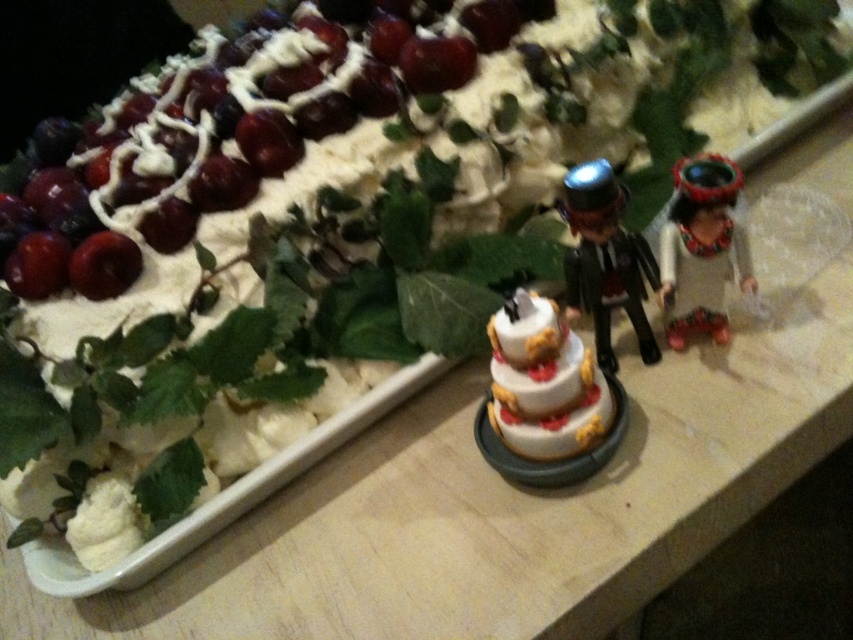
Question: Which of the following is the farthest from the observer?

Choices:
 (A) (96, 288)
 (B) (701, 182)
 (C) (486, 17)

Answer: (C)

Question: Which object is farther from the camera taking this photo?

Choices:
 (A) shiny plastic bride at right
 (B) shiny black toy at center
 (C) white matte tiered cake at center
 (D) shiny red cherries at upper left

Answer: (D)

Question: Is shiny red cherries at upper left below shiny black toy at center?

Choices:
 (A) yes
 (B) no

Answer: (B)

Question: Is shiny red cherries at upper left closer to camera compared to white matte tiered cake at center?

Choices:
 (A) yes
 (B) no

Answer: (B)

Question: Which object is farther from the camera taking this photo?

Choices:
 (A) shiny black toy at center
 (B) shiny red cherry at upper left
 (C) shiny red cherries at upper left

Answer: (C)

Question: Does shiny red cherries at upper left have a smaller size compared to shiny black toy at center?

Choices:
 (A) no
 (B) yes

Answer: (A)